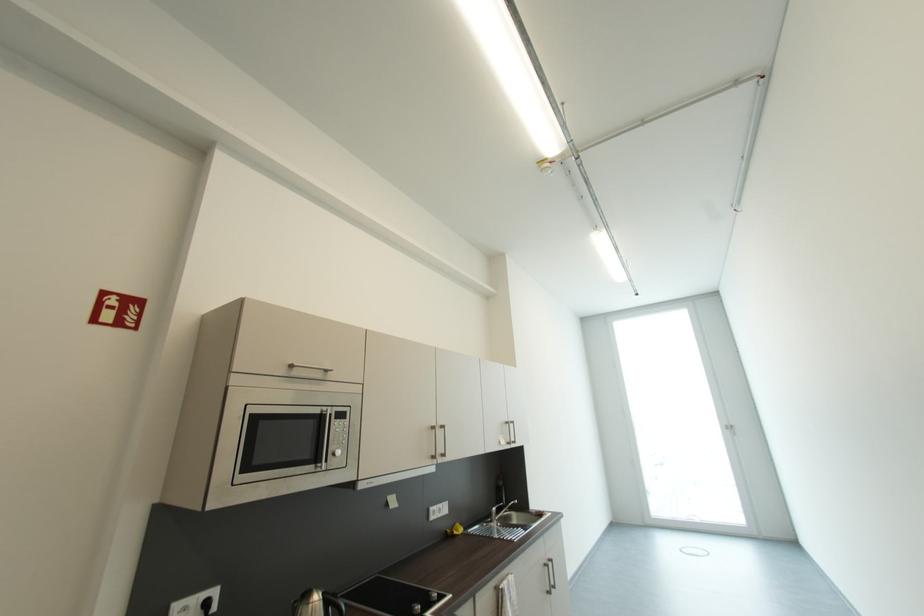
Find where to lift the electric kettle. Please return your answer as a coordinate pair (x, y).

(317, 602)